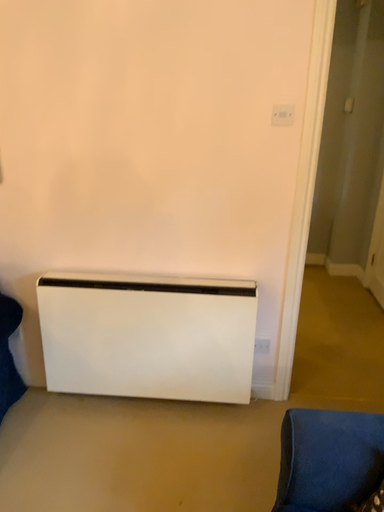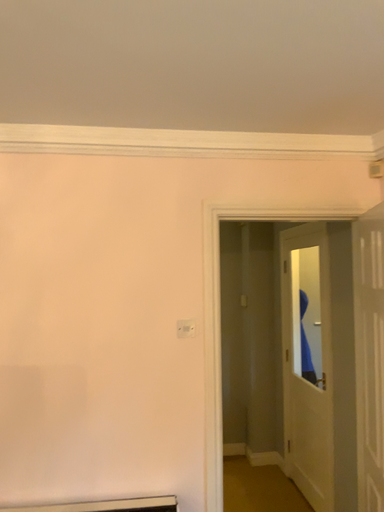
Question: How did the camera likely rotate when shooting the video?

Choices:
 (A) rotated left
 (B) rotated right

Answer: (B)